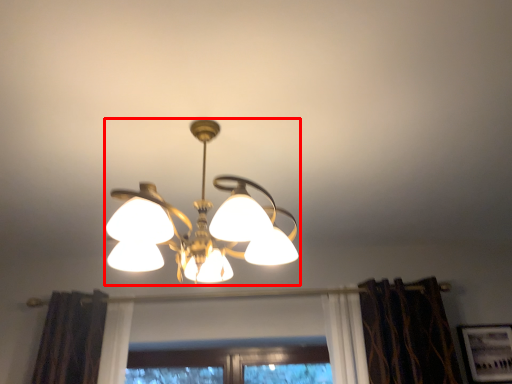
Question: From the image's perspective, considering the relative positions of lamp (annotated by the red box) and picture frame in the image provided, where is lamp (annotated by the red box) located with respect to the staircase?

Choices:
 (A) above
 (B) below

Answer: (A)